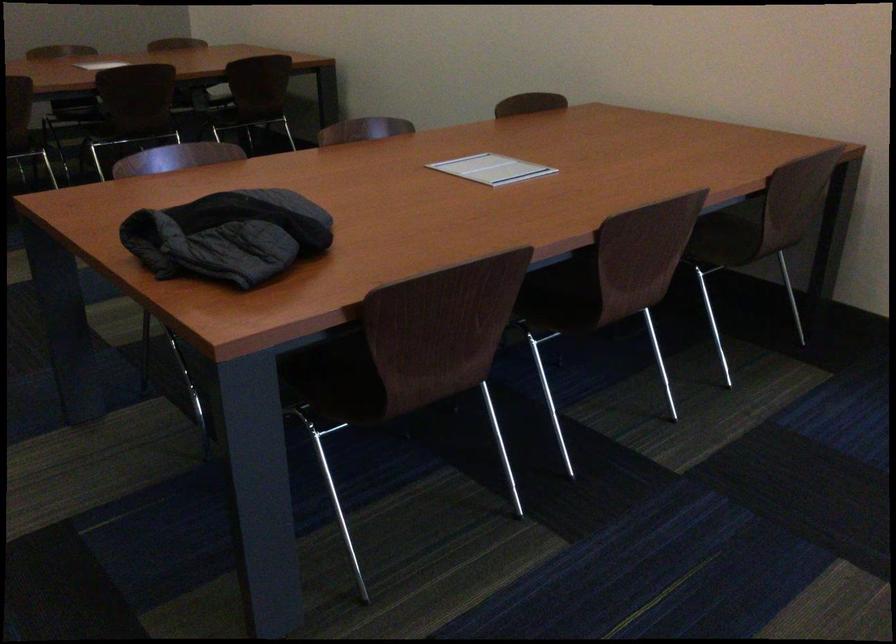
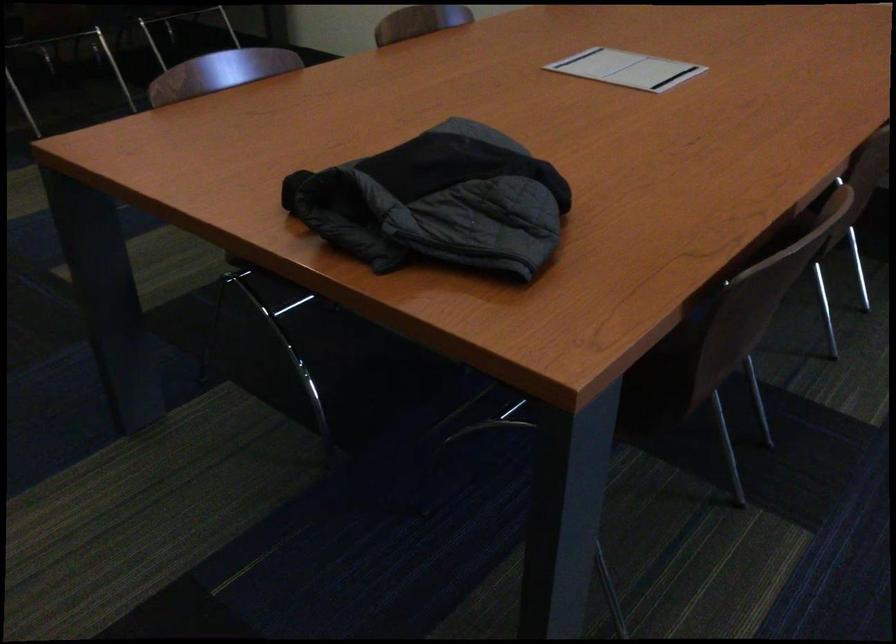
The images are taken continuously from a first-person perspective. In which direction are you moving?

The cameraman walked toward left, forward.